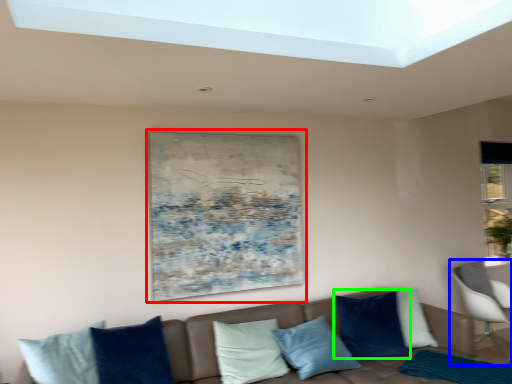
Question: Which object is positioned farthest from picture frame (highlighted by a red box)? Select from chair (highlighted by a blue box) and pillow (highlighted by a green box).

Choices:
 (A) chair
 (B) pillow

Answer: (A)